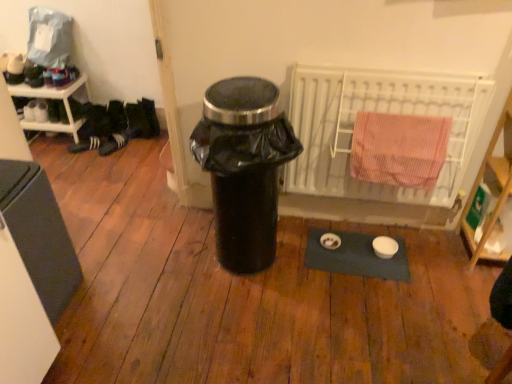
You are a GUI agent. You are given a task and a screenshot of the screen. Output one action in this format:
    pyautogui.click(x=<x>, y=<y>)
    Task: Click on the empty space that is in between matte gray refrigerator at left and black plastic trash can at center
    The height and width of the screenshot is (384, 512).
    Given the screenshot: What is the action you would take?
    pyautogui.click(x=141, y=276)